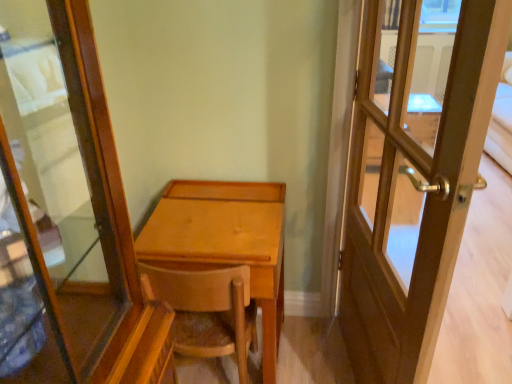
Question: Is wooden chair at center next to light brown wood desk at center?

Choices:
 (A) no
 (B) yes

Answer: (A)

Question: Is wooden chair at center further to the viewer compared to light brown wood desk at center?

Choices:
 (A) yes
 (B) no

Answer: (B)

Question: Is wooden chair at center shorter than light brown wood desk at center?

Choices:
 (A) yes
 (B) no

Answer: (A)

Question: From a real-world perspective, is wooden chair at center physically below light brown wood desk at center?

Choices:
 (A) yes
 (B) no

Answer: (A)

Question: Can you confirm if wooden chair at center is positioned to the right of light brown wood desk at center?

Choices:
 (A) yes
 (B) no

Answer: (B)

Question: From a real-world perspective, is light brown wood desk at center above or below wooden door at right?

Choices:
 (A) above
 (B) below

Answer: (B)

Question: From the image's perspective, relative to wooden door at right, is light brown wood desk at center above or below?

Choices:
 (A) above
 (B) below

Answer: (B)

Question: From their relative heights in the image, would you say light brown wood desk at center is taller or shorter than wooden door at right?

Choices:
 (A) tall
 (B) short

Answer: (B)

Question: Is point (260, 192) closer or farther from the camera than point (436, 175)?

Choices:
 (A) farther
 (B) closer

Answer: (A)

Question: In terms of width, does wooden door at right look wider or thinner when compared to light brown wood desk at center?

Choices:
 (A) thin
 (B) wide

Answer: (A)

Question: In terms of size, does wooden door at right appear bigger or smaller than light brown wood desk at center?

Choices:
 (A) small
 (B) big

Answer: (A)

Question: Is wooden door at right to the left or to the right of light brown wood desk at center in the image?

Choices:
 (A) left
 (B) right

Answer: (B)

Question: Relative to light brown wood desk at center, is wooden door at right in front or behind?

Choices:
 (A) behind
 (B) front

Answer: (B)

Question: From a real-world perspective, is wooden door at right physically located above or below wooden chair at center?

Choices:
 (A) above
 (B) below

Answer: (A)

Question: In terms of width, does wooden door at right look wider or thinner when compared to wooden chair at center?

Choices:
 (A) thin
 (B) wide

Answer: (A)